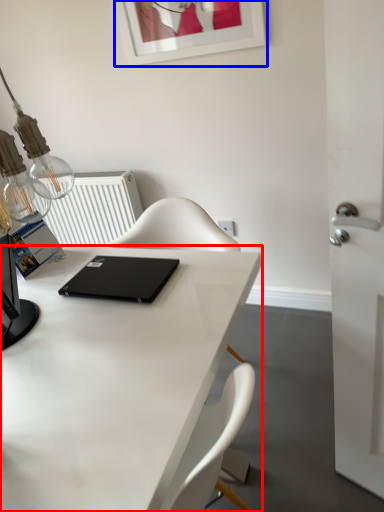
Question: Which of the following is the closest to the observer, desk (highlighted by a red box) or picture frame (highlighted by a blue box)?

Choices:
 (A) desk
 (B) picture frame

Answer: (A)